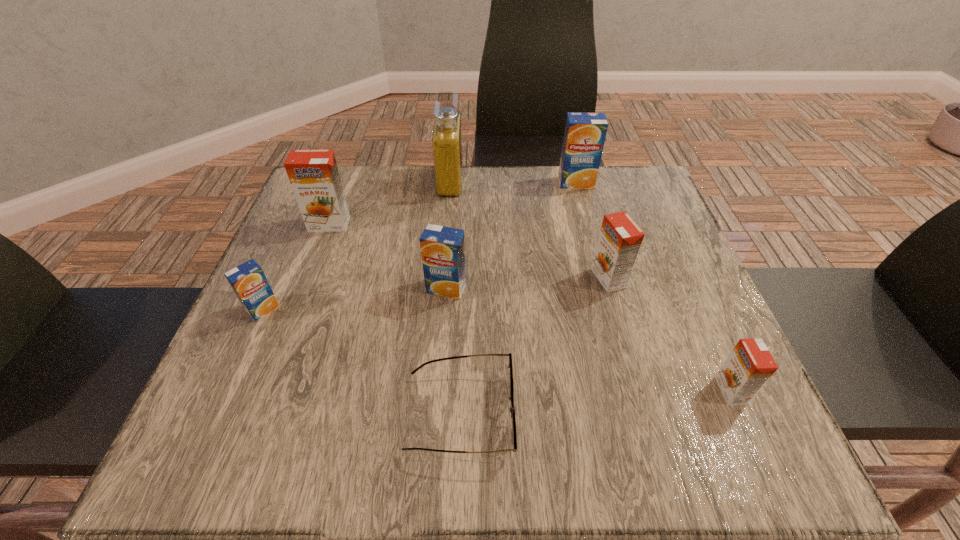
You are a GUI agent. You are given a task and a screenshot of the screen. Output one action in this format:
    pyautogui.click(x=<x>, y=<y>)
    Task: Click on the free spot that satisfies the following two spatial constraints: 1. on the front-facing side of the tallest object; 2. on the left side of the second biggest blue orange_juice
    The image size is (960, 540).
    Given the screenshot: What is the action you would take?
    pyautogui.click(x=442, y=288)